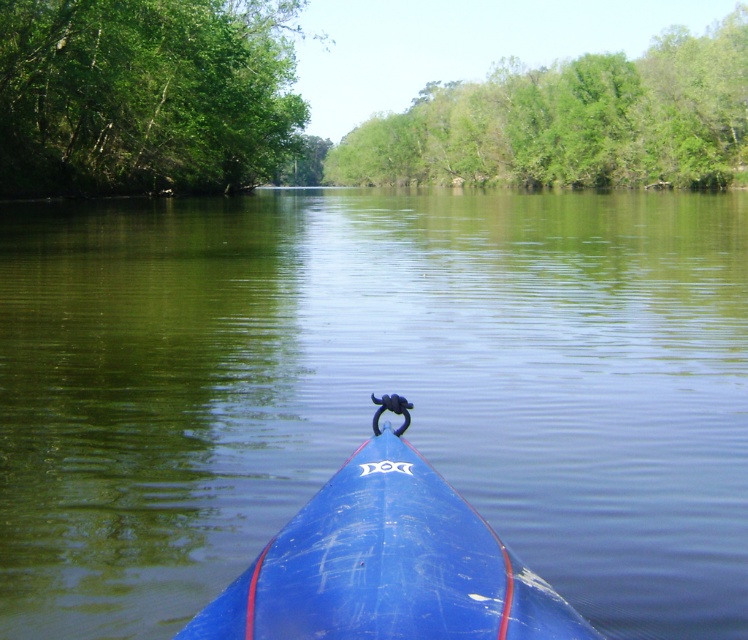
You are in a kayak and need to navigate around a bend in the river. You see the green leafy trees at upper left and the blue glossy kayak at center. Which direction should you turn to avoid hitting the trees?

The green leafy trees at upper left are to the left of the blue glossy kayak at center, so you should turn to the right to avoid hitting the trees.

You are in a kayak and want to know if the green smooth water at center is under the green leafy trees at upper left. Can you confirm this?

Yes, the green smooth water at center is below green leafy trees at upper left, so it is under them.

You are in a blue kayak on a calm river and want to reach a specific point marked at coordinates point (x=99, y=595). If your kayak can travel 10 feet per minute, how long will it take to reach the point?

The distance of point (x=99, y=595) from camera is 23.32 feet. At a speed of 10 feet per minute, it would take approximately 2.33 minutes to reach the point.